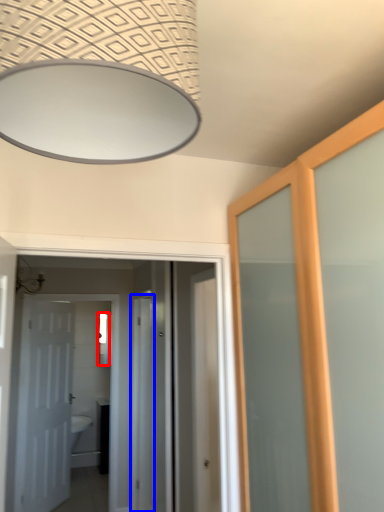
Question: Which object is further to the camera taking this photo, mirror (highlighted by a red box) or screen door (highlighted by a blue box)?

Choices:
 (A) mirror
 (B) screen door

Answer: (A)